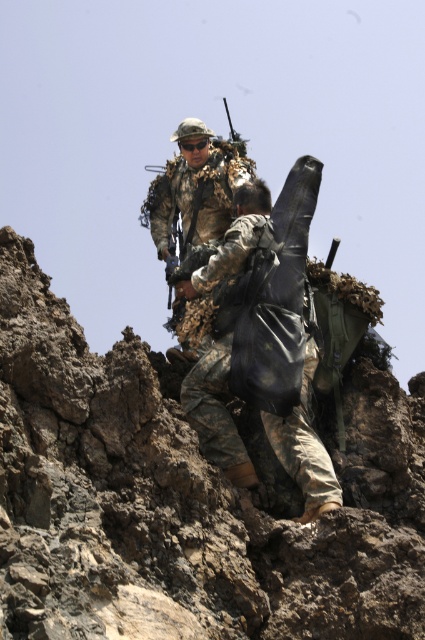
Question: Estimate the real-world distances between objects in this image. Which object is farther from the camouflage fabric uniform at center?

Choices:
 (A) brown rugged rock at center
 (B) camouflage fabric backpack at center

Answer: (A)

Question: Can you confirm if brown rugged rock at center is positioned to the left of camouflage fabric uniform at center?

Choices:
 (A) yes
 (B) no

Answer: (B)

Question: Considering the relative positions of brown rugged rock at center and camouflage fabric backpack at center in the image provided, where is brown rugged rock at center located with respect to camouflage fabric backpack at center?

Choices:
 (A) left
 (B) right

Answer: (A)

Question: Which of these objects is positioned closest to the camouflage fabric backpack at center?

Choices:
 (A) brown rugged rock at center
 (B) camouflage fabric uniform at center

Answer: (A)

Question: Does camouflage fabric backpack at center appear over camouflage fabric uniform at center?

Choices:
 (A) yes
 (B) no

Answer: (B)

Question: Which point is farther to the camera?

Choices:
 (A) brown rugged rock at center
 (B) camouflage fabric uniform at center

Answer: (B)